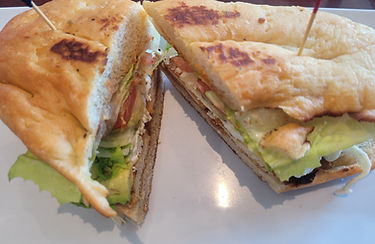
At what (x,y) coordinates should I click in order to perform the action: click on table. Please return your answer as a coordinate pair (x, y). Image resolution: width=375 pixels, height=244 pixels. Looking at the image, I should click on [200, 182].